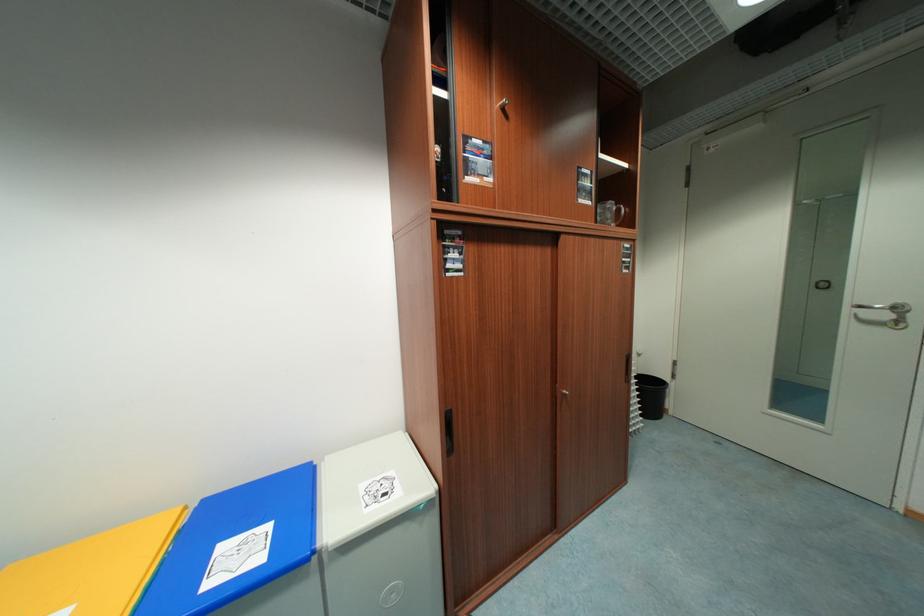
Find the location of `blue bin lid`. blue bin lid is located at coordinates (237, 556).